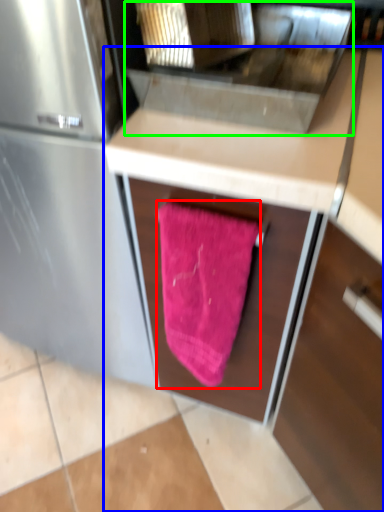
Question: Which object is positioned closest to beach towel (highlighted by a red box)? Select from cabinetry (highlighted by a blue box) and sink (highlighted by a green box).

Choices:
 (A) cabinetry
 (B) sink

Answer: (A)